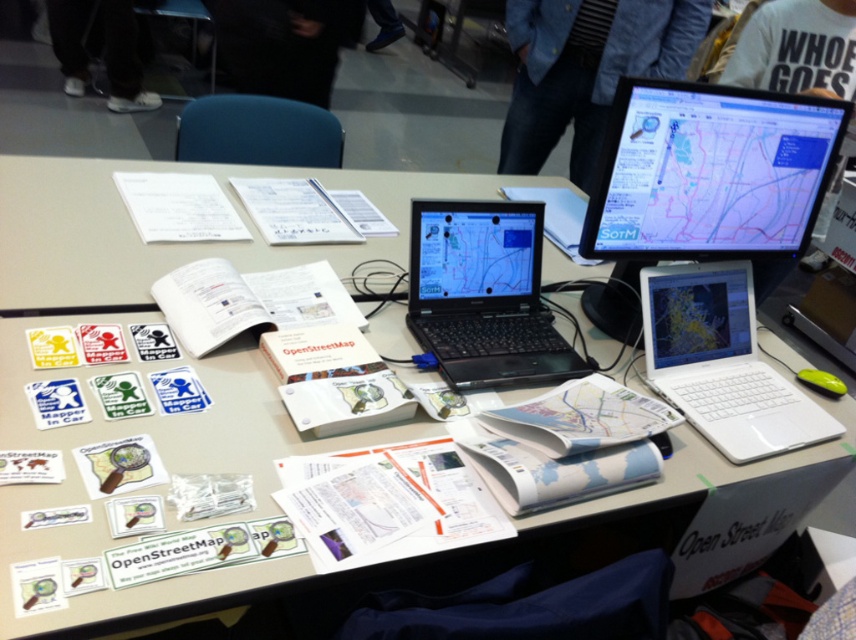
Between point (590, 0) and point (218, 205), which one is positioned in front?

Point (218, 205)

Between blue denim jacket at upper center and white paper at upper left, which one has more height?

blue denim jacket at upper center is taller.

Which is in front, point (615, 4) or point (175, 186)?

Point (175, 186) is in front.

I want to click on blue denim jacket at upper center, so click(586, 68).

Does point (681, 99) come farther from viewer compared to point (455, 342)?

No, it is in front of (455, 342).

Locate an element on the screen. The width and height of the screenshot is (856, 640). black glossy monitor at upper right is located at coordinates pos(703,186).

Where is `black glossy monitor at upper right`? black glossy monitor at upper right is located at coordinates (703, 186).

Locate an element on the screen. black glossy monitor at upper right is located at coordinates click(x=703, y=186).

Is white plastic laptop at center-right to the left of black fabric at center from the viewer's perspective?

No, white plastic laptop at center-right is not to the left of black fabric at center.

Can you confirm if white plastic laptop at center-right is positioned above black fabric at center?

No, white plastic laptop at center-right is not above black fabric at center.

Does point (785, 449) come farther from viewer compared to point (203, 1)?

That is False.

Locate an element on the screen. The image size is (856, 640). white plastic laptop at center-right is located at coordinates (721, 362).